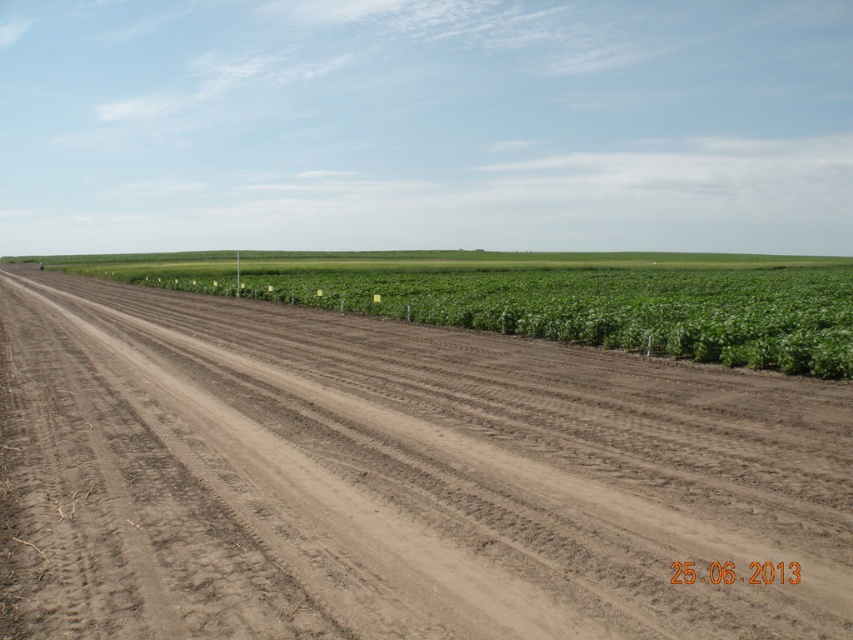
Question: Which object is farther from the camera taking this photo?

Choices:
 (A) green leafy plant at center
 (B) brown soil at center

Answer: (A)

Question: Among these points, which one is nearest to the camera?

Choices:
 (A) (428, 618)
 (B) (764, 320)

Answer: (A)

Question: Which of the following is the closest to the observer?

Choices:
 (A) brown soil at center
 (B) green leafy plant at center

Answer: (A)

Question: Does brown soil at center appear on the left side of green leafy plant at center?

Choices:
 (A) no
 (B) yes

Answer: (A)

Question: Is brown soil at center to the right of green leafy plant at center from the viewer's perspective?

Choices:
 (A) yes
 (B) no

Answer: (A)

Question: Is brown soil at center smaller than green leafy plant at center?

Choices:
 (A) yes
 (B) no

Answer: (A)